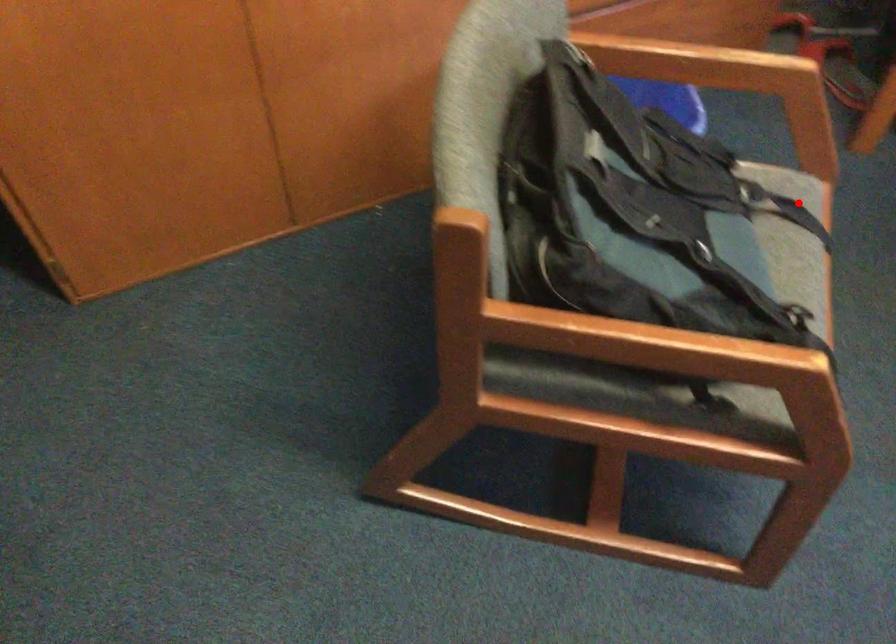
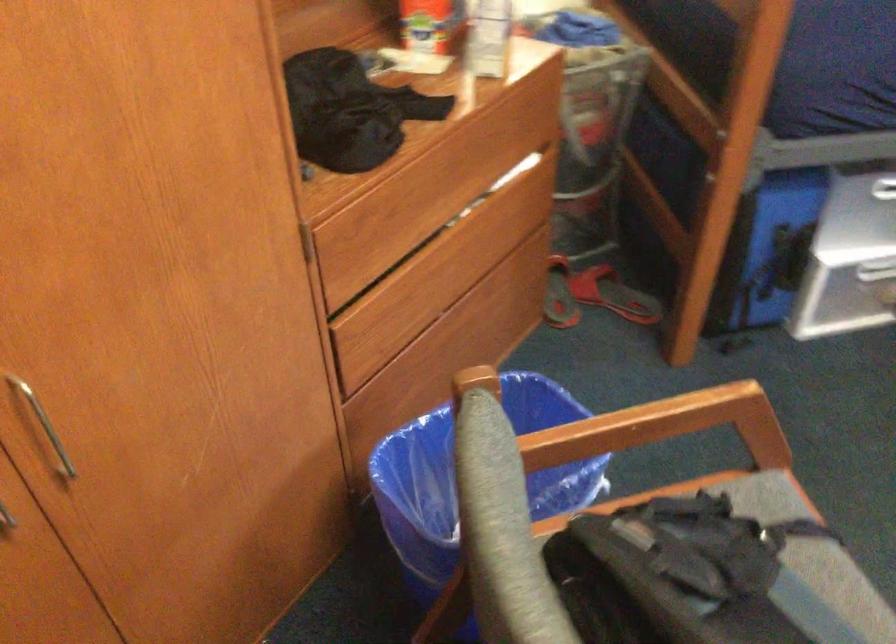
In the second image, find the point that corresponds to the highlighted location in the first image.

(769, 504)